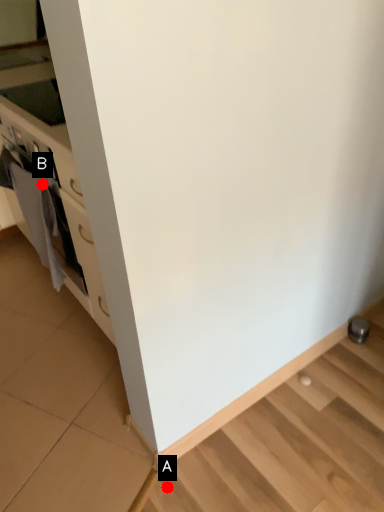
Question: Two points are circled on the image, labeled by A and B beside each circle. Which of the following is the closest to the observer?

Choices:
 (A) A is closer
 (B) B is closer

Answer: (A)